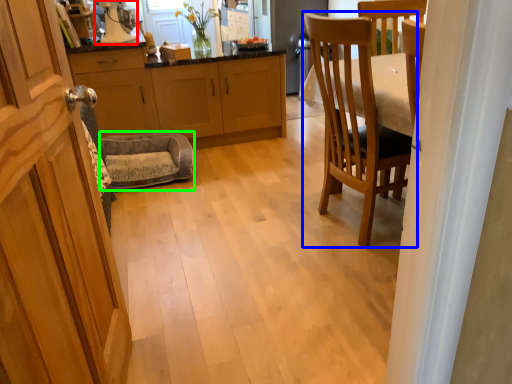
Question: Which is farther away from appliance (highlighted by a red box)? chair (highlighted by a blue box) or rocking chair (highlighted by a green box)?

Choices:
 (A) chair
 (B) rocking chair

Answer: (A)